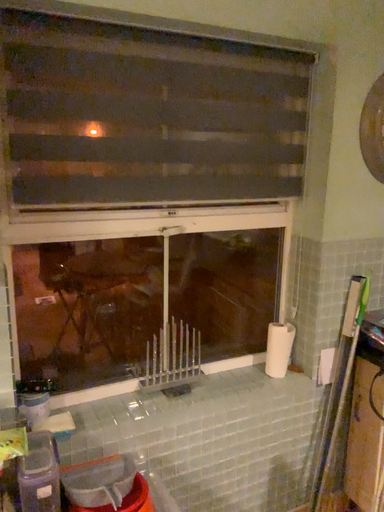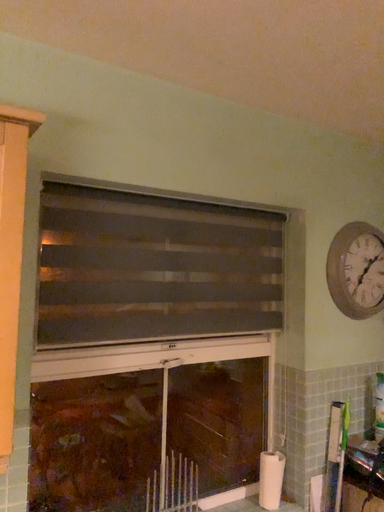
Question: Which way did the camera rotate in the video?

Choices:
 (A) rotated downward
 (B) rotated upward

Answer: (B)